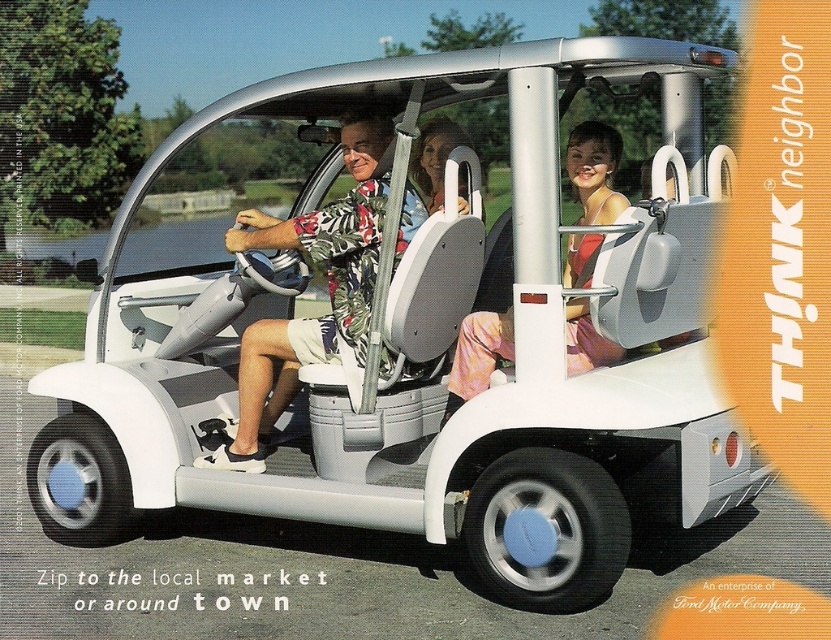
Question: Is floral fabric shirt at center below pink fabric dress at center?

Choices:
 (A) no
 (B) yes

Answer: (B)

Question: Which point is farther from the camera taking this photo?

Choices:
 (A) (579, 259)
 (B) (371, 253)

Answer: (A)

Question: Does floral fabric shirt at center appear on the left side of pink fabric dress at center?

Choices:
 (A) yes
 (B) no

Answer: (A)

Question: Which point is farther to the camera?

Choices:
 (A) pink fabric dress at center
 (B) floral fabric shirt at center

Answer: (B)

Question: Can you confirm if floral fabric shirt at center is smaller than pink fabric dress at center?

Choices:
 (A) yes
 (B) no

Answer: (B)